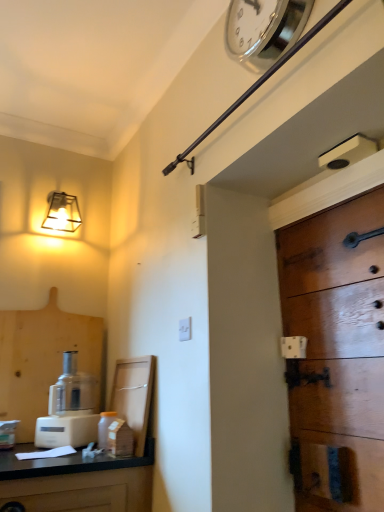
Image resolution: width=384 pixels, height=512 pixels. Find the location of `white plastic food processor at lower left`. white plastic food processor at lower left is located at coordinates (69, 409).

The height and width of the screenshot is (512, 384). What do you see at coordinates (336, 355) in the screenshot? I see `wooden door at right` at bounding box center [336, 355].

Find the location of a particular element. The height and width of the screenshot is (512, 384). metallic square lamp at upper left is located at coordinates (62, 213).

Is the position of white plastic light switch at center more distant than that of white plastic food processor at lower left?

No, it is in front of white plastic food processor at lower left.

From the picture: Would you say white plastic light switch at center contains white plastic food processor at lower left?

No, white plastic light switch at center does not contain white plastic food processor at lower left.

Is white plastic light switch at center positioned far away from white plastic food processor at lower left?

No, there isn't a large distance between white plastic light switch at center and white plastic food processor at lower left.

Considering the sizes of objects white plastic light switch at center and white plastic food processor at lower left in the image provided, who is shorter, white plastic light switch at center or white plastic food processor at lower left?

With less height is white plastic light switch at center.

Is translucent glass jar at lower left facing away from wooden cabinet at lower left?

translucent glass jar at lower left does not have its back to wooden cabinet at lower left.

From the image's perspective, which one is positioned lower, translucent glass jar at lower left or wooden cabinet at lower left?

translucent glass jar at lower left.

The width and height of the screenshot is (384, 512). In order to click on cabinetry above the translucent glass jar at lower left (from a real-world perspective) in this screenshot , I will do `click(134, 396)`.

Is translucent glass jar at lower left further to the viewer compared to wooden cabinet at lower left?

Yes, it is.

Measure the distance from wooden door at right to white plastic food processor at lower left.

The distance of wooden door at right from white plastic food processor at lower left is 1.14 meters.

Is wooden door at right facing away from white plastic food processor at lower left?

wooden door at right is not turned away from white plastic food processor at lower left.

Are wooden door at right and white plastic food processor at lower left far apart?

Yes, wooden door at right is far from white plastic food processor at lower left.

Between wooden door at right and white plastic food processor at lower left, which one is positioned in front?

wooden door at right is in front.

Is white plastic food processor at lower left far away from silver metallic clock at upper center?

Yes.

Is white plastic food processor at lower left shorter than silver metallic clock at upper center?

In fact, white plastic food processor at lower left may be taller than silver metallic clock at upper center.

In the scene shown: Between white plastic food processor at lower left and silver metallic clock at upper center, which one has larger size?

white plastic food processor at lower left is bigger.

Is white plastic light switch at center outside of metallic square lamp at upper left?

That's correct, white plastic light switch at center is outside of metallic square lamp at upper left.

Based on the photo, is white plastic light switch at center to the right of metallic square lamp at upper left from the viewer's perspective?

Indeed, white plastic light switch at center is positioned on the right side of metallic square lamp at upper left.

Between white plastic light switch at center and metallic square lamp at upper left, which one has smaller size?

Smaller between the two is white plastic light switch at center.

Find the location of a particular element. Image resolution: width=384 pixels, height=512 pixels. lamp located above the white plastic light switch at center (from a real-world perspective) is located at coordinates (62, 213).

Based on the photo, considering the sizes of objects wooden door at right and wooden cabinet at lower left in the image provided, who is shorter, wooden door at right or wooden cabinet at lower left?

Standing shorter between the two is wooden cabinet at lower left.

Between wooden door at right and wooden cabinet at lower left, which one has larger size?

With larger size is wooden door at right.

Considering the relative sizes of wooden door at right and wooden cabinet at lower left in the image provided, is wooden door at right wider than wooden cabinet at lower left?

No.

Between white plastic light switch at center and wooden cabinet at lower left, which one has larger width?

With larger width is wooden cabinet at lower left.

Identify the location of cabinetry behind the white plastic light switch at center. (134, 396).

Is white plastic light switch at center bigger than wooden cabinet at lower left?

No.

From the image's perspective, is white plastic light switch at center located above or below wooden cabinet at lower left?

From the image's perspective, white plastic light switch at center appears above wooden cabinet at lower left.

The width and height of the screenshot is (384, 512). I want to click on light switch above the white plastic food processor at lower left (from the image's perspective), so click(x=185, y=329).

You are a GUI agent. You are given a task and a screenshot of the screen. Output one action in this format:
    pyautogui.click(x=<x>, y=<y>)
    Task: Click on the bottle below the wooden cabinet at lower left (from the image's perspective)
    
    Given the screenshot: What is the action you would take?
    [105, 428]

Based on their spatial positions, is wooden cabinet at lower left or white plastic light switch at center closer to wooden door at right?

white plastic light switch at center is closer to wooden door at right.

Considering their positions, is silver metallic clock at upper center positioned further to wooden door at right than translucent glass jar at lower left?

translucent glass jar at lower left.

Which object lies nearer to the anchor point wooden cabinet at lower left, metallic square lamp at upper left or wooden door at right?

wooden door at right.

Considering their positions, is metallic square lamp at upper left positioned closer to white plastic light switch at center than white plastic food processor at lower left?

white plastic food processor at lower left is closer to white plastic light switch at center.

From the image, which object appears to be nearer to white plastic light switch at center, white plastic food processor at lower left or translucent glass jar at lower left?

translucent glass jar at lower left.

When comparing their distances from white plastic light switch at center, does white plastic food processor at lower left or metallic square lamp at upper left seem closer?

white plastic food processor at lower left is positioned closer to the anchor white plastic light switch at center.

When comparing their distances from white plastic light switch at center, does wooden cabinet at lower left or silver metallic clock at upper center seem further?

silver metallic clock at upper center.

Consider the image. When comparing their distances from metallic square lamp at upper left, does white plastic food processor at lower left or wooden door at right seem closer?

The object closer to metallic square lamp at upper left is white plastic food processor at lower left.

Find the location of `light switch between wooden door at right and translucent glass jar at lower left along the z-axis`. light switch between wooden door at right and translucent glass jar at lower left along the z-axis is located at coordinates (185, 329).

Where is `cabinetry between metallic square lamp at upper left and translucent glass jar at lower left vertically`? The image size is (384, 512). cabinetry between metallic square lamp at upper left and translucent glass jar at lower left vertically is located at coordinates (134, 396).

The width and height of the screenshot is (384, 512). Find the location of `light switch between metallic square lamp at upper left and wooden cabinet at lower left from top to bottom`. light switch between metallic square lamp at upper left and wooden cabinet at lower left from top to bottom is located at coordinates (185, 329).

What are the coordinates of `light switch positioned between wooden door at right and metallic square lamp at upper left from near to far` in the screenshot? It's located at (185, 329).